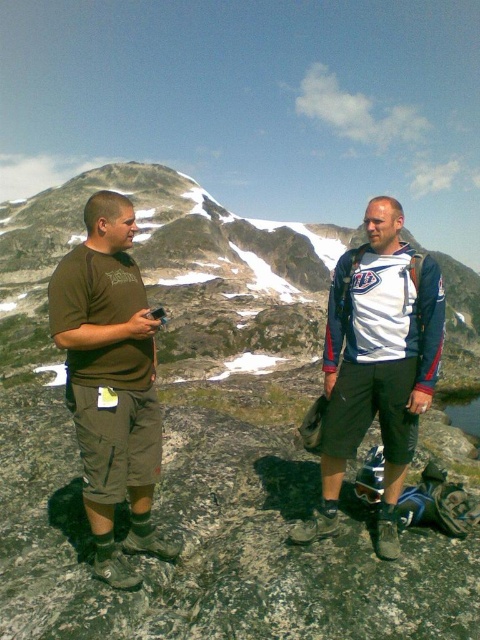
Between point (240, 340) and point (154, 547), which one is positioned in front?

Point (154, 547) is in front.

Locate an element on the screen. The height and width of the screenshot is (640, 480). matte brown rock at center is located at coordinates (177, 275).

Describe the element at coordinates (177, 275) in the screenshot. I see `matte brown rock at center` at that location.

Where is `matte brown rock at center`? The height and width of the screenshot is (640, 480). matte brown rock at center is located at coordinates (177, 275).

Is brown cotton t-shirt at left positioned behind white jersey at center?

No.

Does brown cotton t-shirt at left have a larger size compared to white jersey at center?

Incorrect, brown cotton t-shirt at left is not larger than white jersey at center.

You are a GUI agent. You are given a task and a screenshot of the screen. Output one action in this format:
    pyautogui.click(x=<x>, y=<y>)
    Task: Click on the brown cotton t-shirt at left
    This screenshot has width=480, height=640.
    Given the screenshot: What is the action you would take?
    pyautogui.click(x=110, y=381)

Can you confirm if matte brown rock at center is positioned below white jersey at center?

Actually, matte brown rock at center is above white jersey at center.

Can you confirm if matte brown rock at center is positioned above white jersey at center?

Indeed, matte brown rock at center is positioned over white jersey at center.

At what (x,y) coordinates should I click in order to perform the action: click on matte brown rock at center. Please return your answer as a coordinate pair (x, y). Looking at the image, I should click on (177, 275).

Find the location of a particular element. The image size is (480, 640). matte brown rock at center is located at coordinates (177, 275).